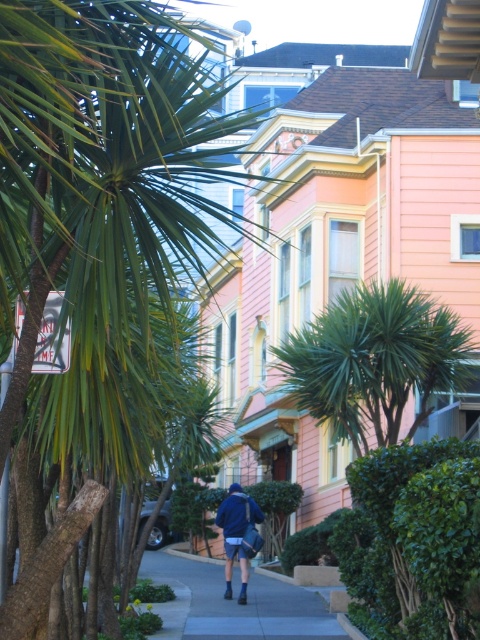
Is point (200, 230) closer to viewer compared to point (248, 509)?

Yes.

Does green leafy palm tree at center have a lesser height compared to blue fabric jacket at center?

Incorrect, green leafy palm tree at center's height does not fall short of blue fabric jacket at center's.

Which is in front, point (26, 260) or point (248, 556)?

Point (26, 260) is in front.

The height and width of the screenshot is (640, 480). In order to click on green leafy palm tree at center in this screenshot , I will do `click(101, 186)`.